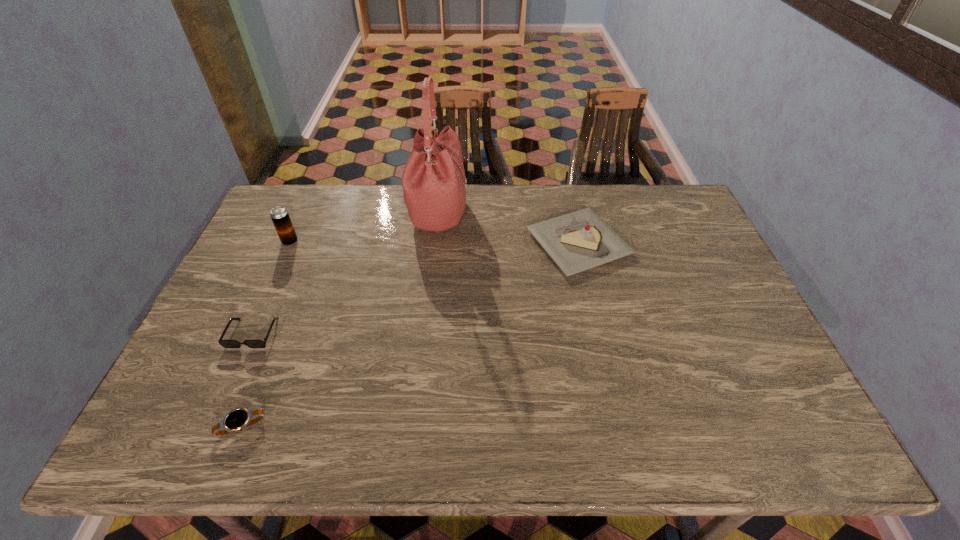
You are a GUI agent. You are given a task and a screenshot of the screen. Output one action in this format:
    pyautogui.click(x=<x>, y=<y>)
    Task: Click on the second object from right to left
    This screenshot has height=540, width=960.
    Given the screenshot: What is the action you would take?
    pyautogui.click(x=434, y=184)

Identify the location of the tallest object. Image resolution: width=960 pixels, height=540 pixels. (434, 184).

Identify the location of the fourth shortest object. This screenshot has width=960, height=540. (280, 217).

Locate an element on the screen. Image resolution: width=960 pixels, height=540 pixels. cake is located at coordinates (578, 241).

The image size is (960, 540). Find the location of `the third tallest object`. the third tallest object is located at coordinates (578, 241).

Where is `sunglasses`? sunglasses is located at coordinates point(225,343).

The height and width of the screenshot is (540, 960). Identify the location of watch. (236, 420).

Find the location of a particular element. free space located on the front of the second object from right to left is located at coordinates (434, 259).

The height and width of the screenshot is (540, 960). I want to click on vacant space located on the right of the beer can, so click(324, 241).

At what (x,y) coordinates should I click in order to perform the action: click on blank area located 0.270m on the left of the third tallest object. Please return your answer as a coordinate pair (x, y). Image resolution: width=960 pixels, height=540 pixels. Looking at the image, I should click on (443, 244).